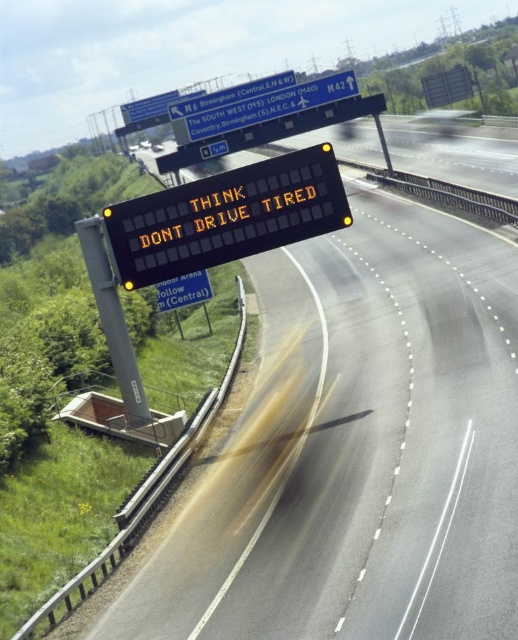
Is yellow reflective electronic display at upper center further to the viewer compared to green reflective sign at central?

Yes, it is behind green reflective sign at central.

Is yellow reflective electronic display at upper center bigger than green reflective sign at central?

Yes, yellow reflective electronic display at upper center is bigger than green reflective sign at central.

At what (x,y) coordinates should I click in order to perform the action: click on yellow reflective electronic display at upper center. Please return your answer as a coordinate pair (x, y). Looking at the image, I should click on (229, 93).

At what (x,y) coordinates should I click in order to perform the action: click on yellow reflective electronic display at upper center. Please return your answer as a coordinate pair (x, y). The width and height of the screenshot is (518, 640). Looking at the image, I should click on (229, 93).

Does point (491, 305) come farther from viewer compared to point (294, 92)?

That is False.

Between black electronic sign at center and yellow reflective plastic sign at upper center, which one appears on the left side from the viewer's perspective?

yellow reflective plastic sign at upper center is more to the left.

Between point (410, 336) and point (199, 116), which one is positioned in front?

Point (410, 336) is in front.

Locate an element on the screen. black electronic sign at center is located at coordinates (357, 449).

Is point (126, 616) in front of point (171, 308)?

Yes, point (126, 616) is in front of point (171, 308).

Is point (240, 451) positioned in front of point (208, 291)?

Yes, it is.

The width and height of the screenshot is (518, 640). Identify the location of black electronic sign at center. (357, 449).